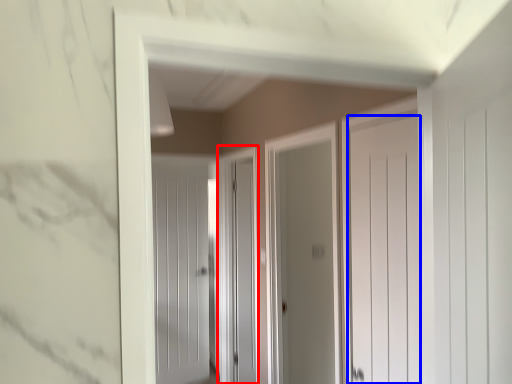
Question: Which point is closer to the camera, screen door (highlighted by a red box) or door (highlighted by a blue box)?

Choices:
 (A) screen door
 (B) door

Answer: (B)